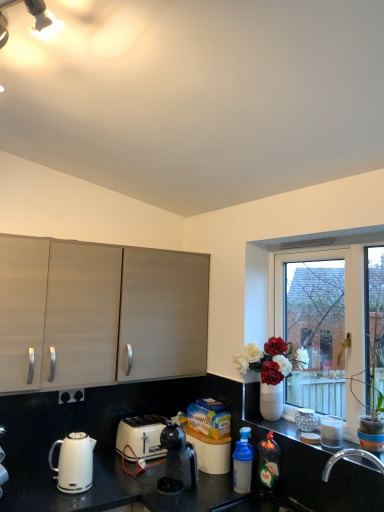
Question: Does point (299, 416) appear closer or farther from the camera than point (339, 426)?

Choices:
 (A) farther
 (B) closer

Answer: (A)

Question: Based on their positions, is metallic silver canisters at right, marked as the 1th appliance in a back-to-front arrangement, located to the left or right of white glossy jar at lower right, positioned as the first appliance in front-to-back order?

Choices:
 (A) right
 (B) left

Answer: (B)

Question: Based on their relative distances, which object is nearer to the black plastic coffee maker at center?

Choices:
 (A) black plastic electrical outlet at lower left
 (B) white glossy sink at lower right
 (C) translucent plastic bottle at lower right, the 1th bottle from the left
 (D) matte wood cabinets at left
 (E) white glass window at right

Answer: (B)

Question: Which object is positioned farthest from the white glossy jar at lower right, positioned as the first appliance in front-to-back order?

Choices:
 (A) translucent plastic bottle at lower right, which is counted as the second bottle, starting from the right
 (B) white plastic toaster at lower center
 (C) metallic silver canisters at right, marked as the 2th appliance in a front-to-back arrangement
 (D) black plastic electrical outlet at lower left
 (E) translucent plastic bottle at lower right, placed as the 1th bottle when sorted from right to left

Answer: (D)